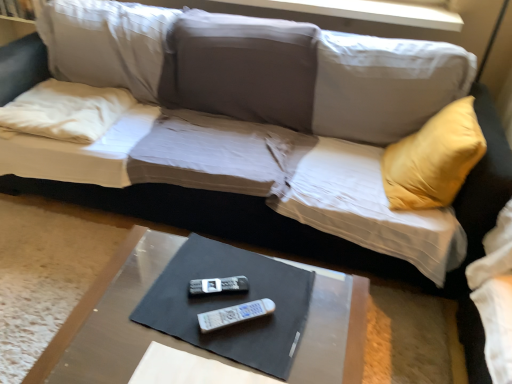
The image size is (512, 384). I want to click on empty space that is ontop of smooth brown table at lower center (from a real-world perspective), so click(216, 315).